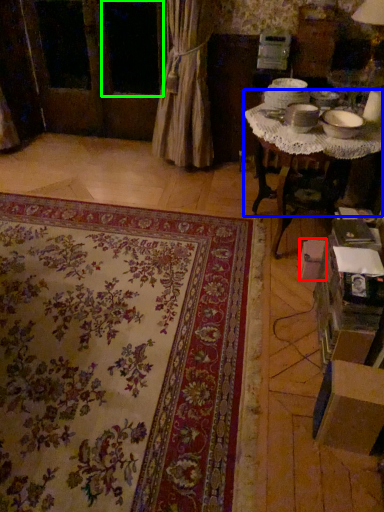
Question: Which is nearer to the cardboard box (highlighted by a red box)? table (highlighted by a blue box) or window (highlighted by a green box).

Choices:
 (A) table
 (B) window

Answer: (A)